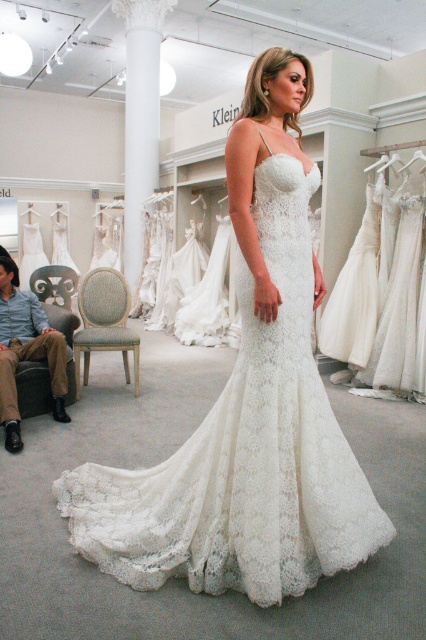
You are a customer in the bridal shop and want to know which dress has a wider silhouette. The white lace dress at center and the matte white dress at lower left are both options. Which one is wider?

The white lace dress at center is wider than the matte white dress at lower left according to the description.

You are a customer in the bridal shop and want to see both the white lace dress at center and the matte white dress at lower left. Which dress should you look at first if you want to start from the higher position?

The white lace dress at center is above the matte white dress at lower left, so you should look at the white lace dress at center first.

You are a photographer setting up for a photoshoot in the bridal shop. You need to position a lighting rig between the white lace dress at center and the white marble column at center. Based on their widths, can the rig be placed there without overlapping either object?

The white lace dress at center might be wider than the white marble column at center, so there is uncertainty about whether the lighting rig can fit between them without overlapping. Further measurement or confirmation of their exact widths would be needed to determine this.